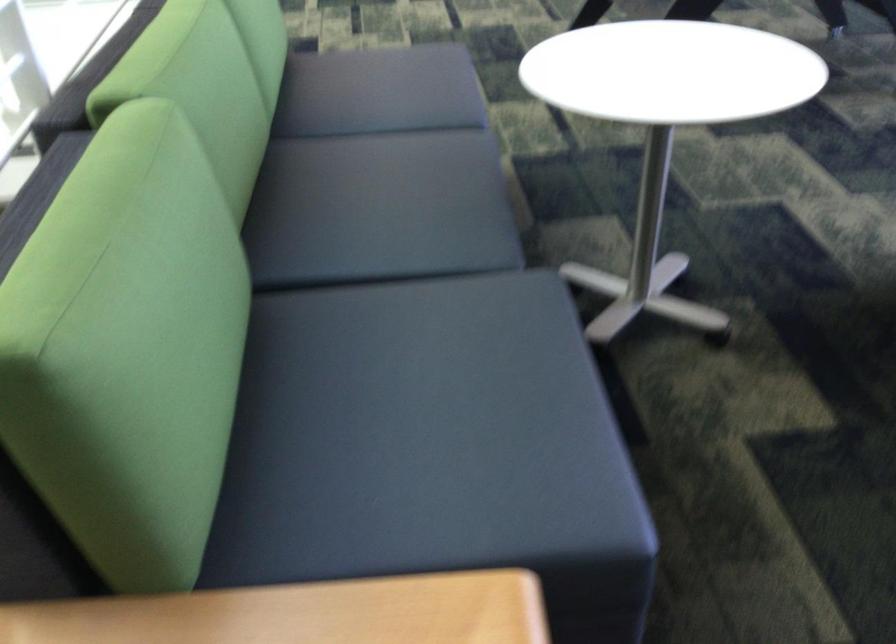
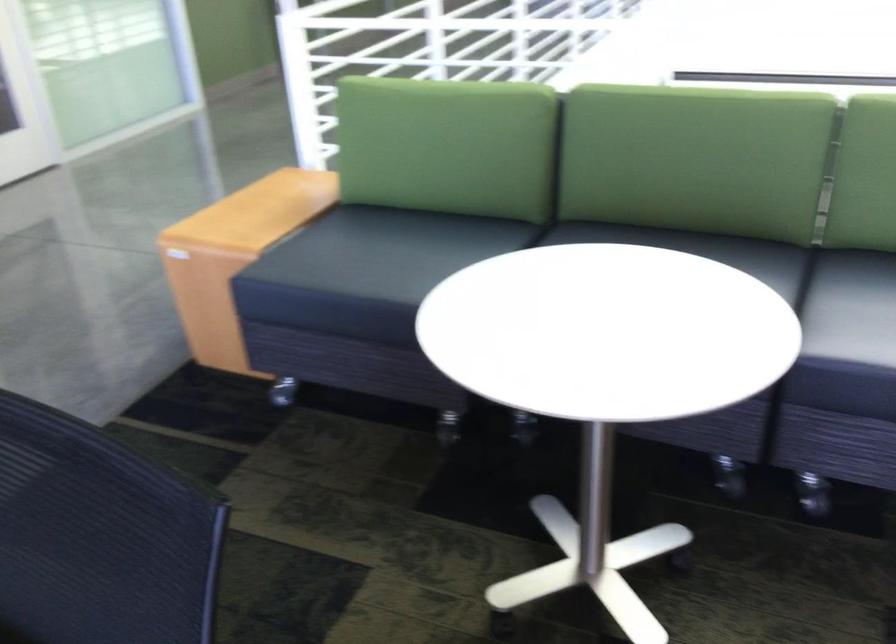
Locate, in the second image, the point that corresponds to [416,107] in the first image.

(851, 307)